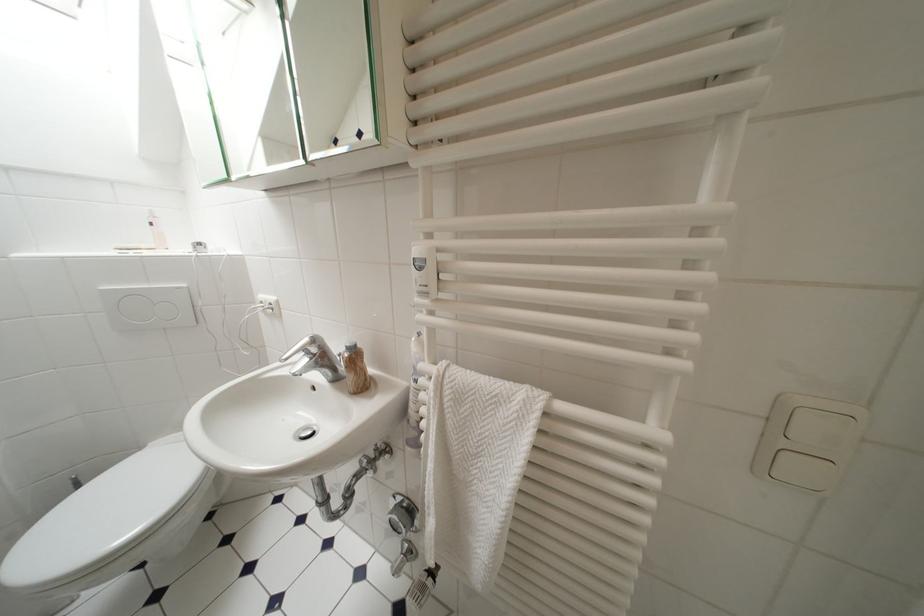
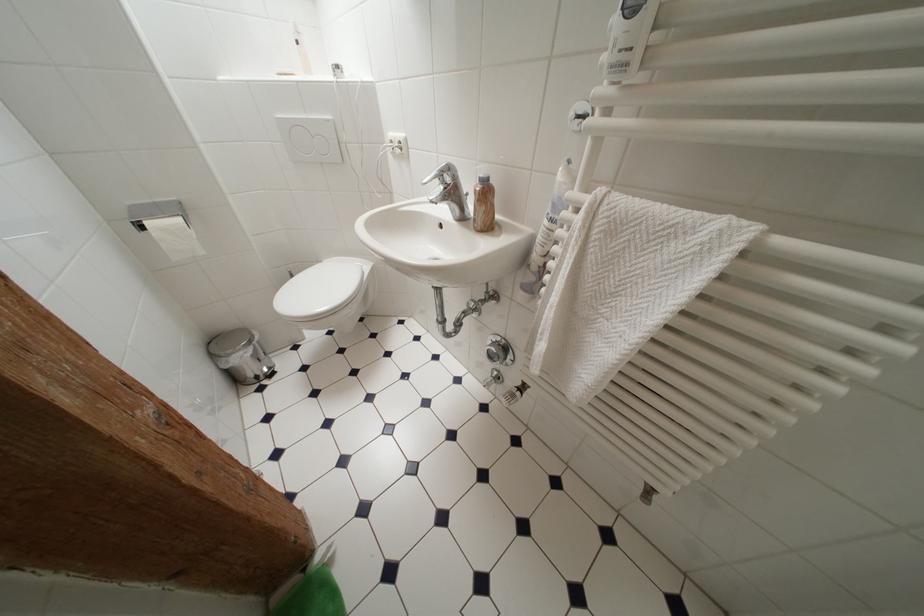
The point at (439, 496) is marked in the first image. Where is the corresponding point in the second image?

(555, 325)